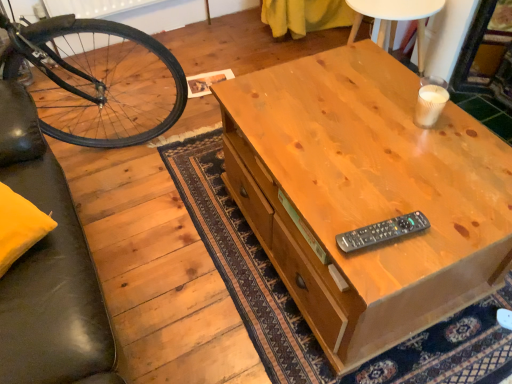
At what (x,y) coordinates should I click in order to perform the action: click on vacant space behind white paper cup at upper right. Please return your answer as a coordinate pair (x, y). This screenshot has height=384, width=512. Looking at the image, I should click on 388,86.